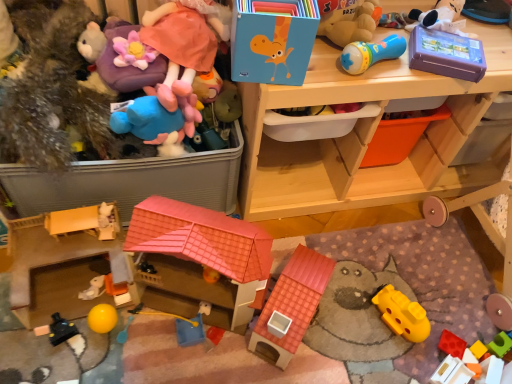
Locate an element on the screen. vacant point above purple plush toy at upper left, which is the ninth toy in right-to-left order (from a real-world perspective) is located at coordinates (129, 22).